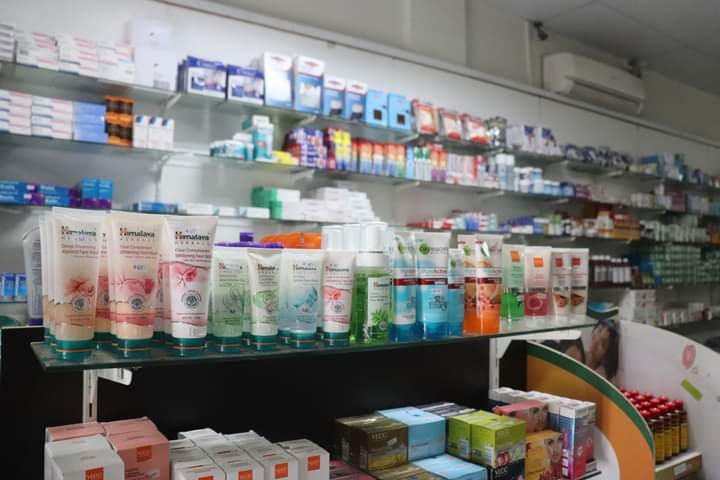
Image resolution: width=720 pixels, height=480 pixels. Identify the location of lotion. (199, 293).